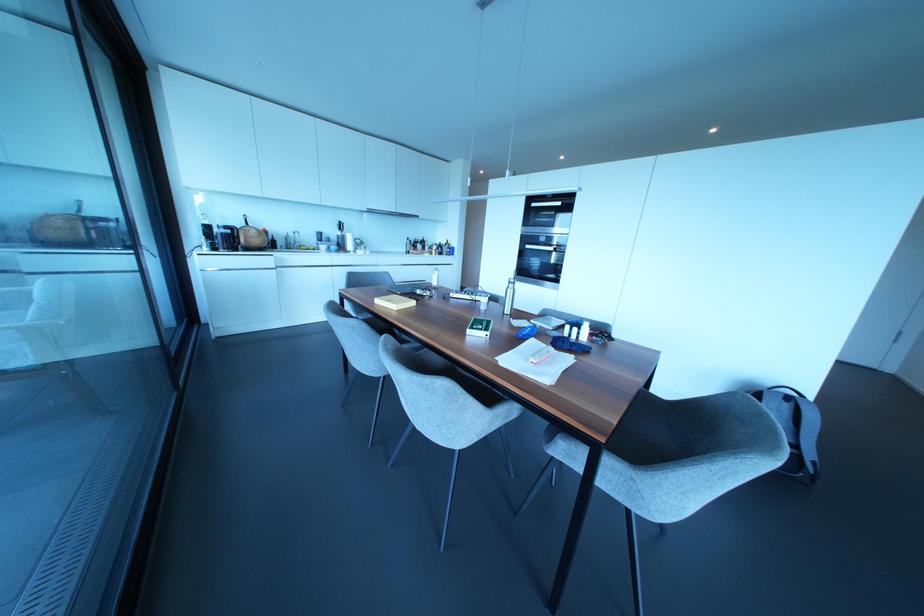
What do you see at coordinates (627, 437) in the screenshot?
I see `the gray chair sitting surface` at bounding box center [627, 437].